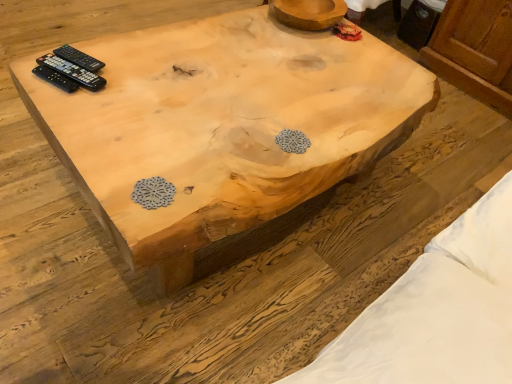
Identify the location of unoccupied region to the right of black plastic remote controls at upper left, the second remote control from the back. The height and width of the screenshot is (384, 512). (135, 78).